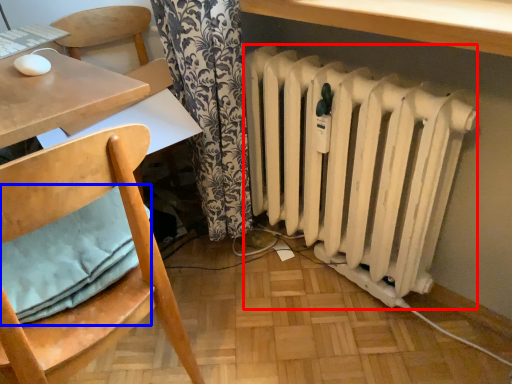
Question: Which of the following is the farthest to the observer, radiator (highlighted by a red box) or pillow (highlighted by a blue box)?

Choices:
 (A) radiator
 (B) pillow

Answer: (A)